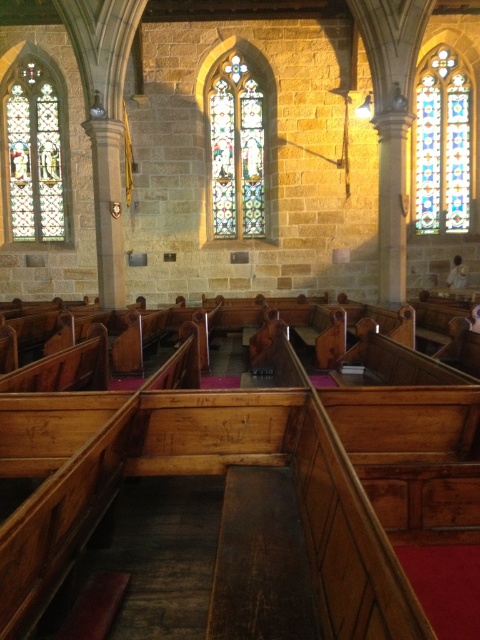
Question: Which object is closer to the camera taking this photo?

Choices:
 (A) stained glass window at center
 (B) smooth wooden pew at center

Answer: (B)

Question: Estimate the real-world distances between objects in this image. Which object is closer to the stained glass window at upper right?

Choices:
 (A) smooth wooden pew at center
 (B) stained glass window at center
 (C) stained glass window at left

Answer: (A)

Question: Can you confirm if stained glass window at left is smaller than smooth wooden pew at center?

Choices:
 (A) yes
 (B) no

Answer: (B)

Question: Can you confirm if stained glass window at center is positioned below smooth wooden pew at center?

Choices:
 (A) yes
 (B) no

Answer: (B)

Question: Is stained glass window at left above stained glass window at center?

Choices:
 (A) no
 (B) yes

Answer: (B)

Question: Which point is farther to the camera?

Choices:
 (A) stained glass window at left
 (B) stained glass window at upper right
 (C) smooth wooden pew at center
 (D) stained glass window at center

Answer: (A)